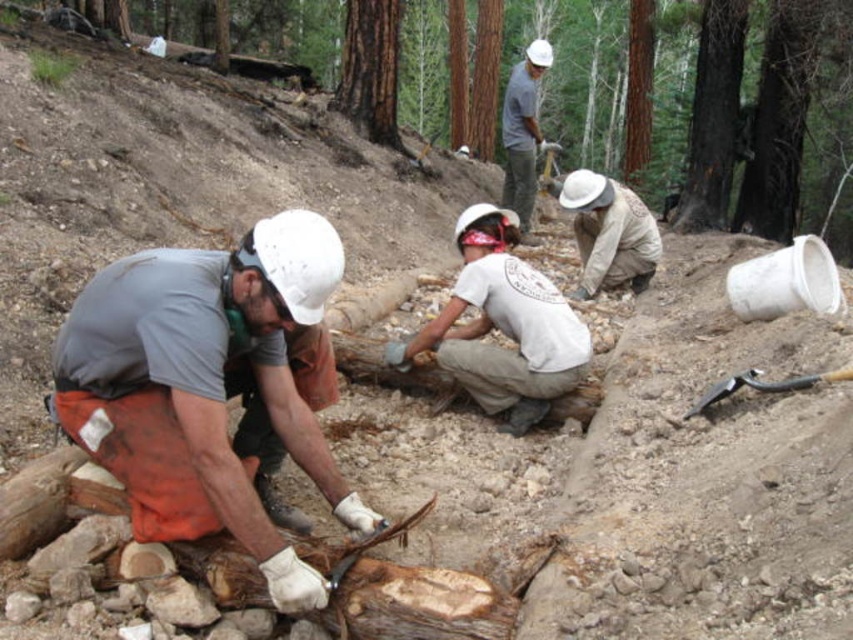
Can you confirm if brown wood log at center is shorter than white matte helmet at center?

Incorrect, brown wood log at center's height does not fall short of white matte helmet at center's.

Is brown wood log at center below white matte helmet at center?

Incorrect, brown wood log at center is not positioned below white matte helmet at center.

Locate an element on the screen. Image resolution: width=853 pixels, height=640 pixels. brown wood log at center is located at coordinates (799, 93).

Based on the photo, is orange work pants at left closer to camera compared to camouflage fabric shirt at center?

Yes, orange work pants at left is in front of camouflage fabric shirt at center.

In the scene shown: Between orange work pants at left and camouflage fabric shirt at center, which one is positioned higher?

camouflage fabric shirt at center is higher up.

Between point (279, 228) and point (643, 285), which one is positioned behind?

Positioned behind is point (643, 285).

Identify the location of orange work pants at left. This screenshot has height=640, width=853. (206, 387).

Does white matte helmet at upper center have a lesser width compared to black metal shovel at lower center?

No, white matte helmet at upper center is not thinner than black metal shovel at lower center.

Is white matte helmet at upper center further to the viewer compared to black metal shovel at lower center?

That is True.

Is point (509, 131) positioned behind point (817, 378)?

Yes, it is.

You are a GUI agent. You are given a task and a screenshot of the screen. Output one action in this format:
    pyautogui.click(x=<x>, y=<y>)
    Task: Click on the white matte helmet at upper center
    This screenshot has width=853, height=640.
    Given the screenshot: What is the action you would take?
    (521, 131)